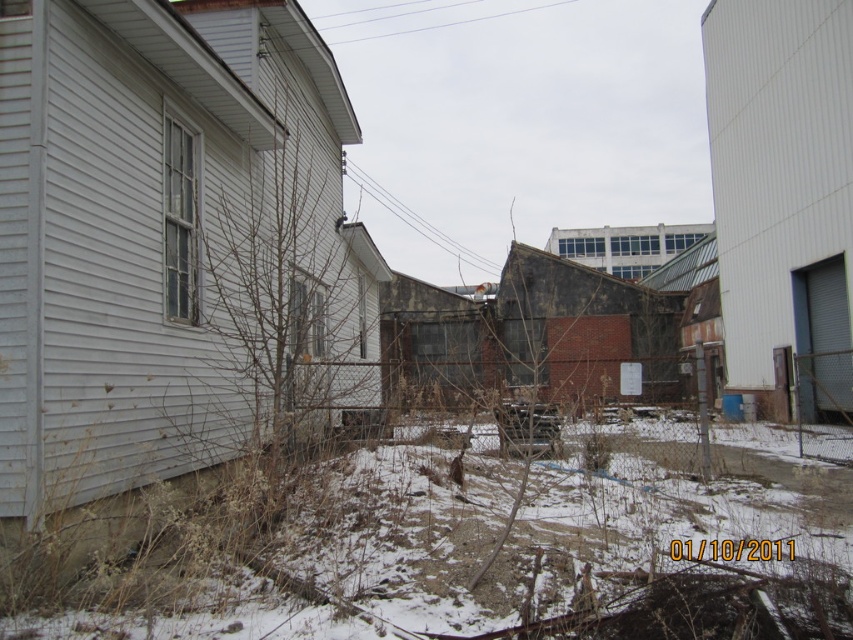
Between point (433, 241) and point (352, 40), which one is positioned in front?

Point (433, 241)

Does point (376, 195) come in front of point (480, 16)?

Yes, point (376, 195) is in front of point (480, 16).

The height and width of the screenshot is (640, 853). I want to click on metallic wire at upper center, so click(x=415, y=218).